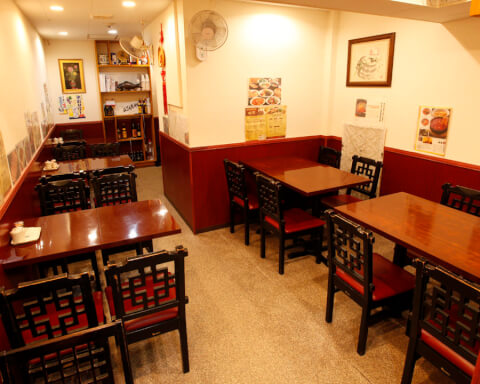
Where is `chair`? This screenshot has height=384, width=480. chair is located at coordinates (396, 291).